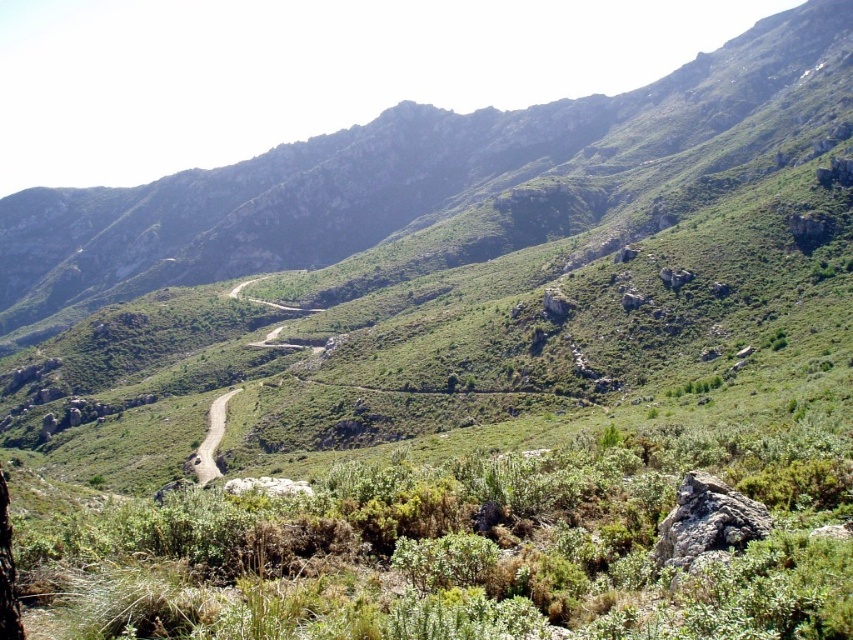
Is green shrubbery at center thinner than dirt/path at center?

Indeed, green shrubbery at center has a lesser width compared to dirt/path at center.

Is green shrubbery at center to the left of dirt/path at center from the viewer's perspective?

Incorrect, green shrubbery at center is not on the left side of dirt/path at center.

Where is `green shrubbery at center`? Image resolution: width=853 pixels, height=640 pixels. green shrubbery at center is located at coordinates (479, 548).